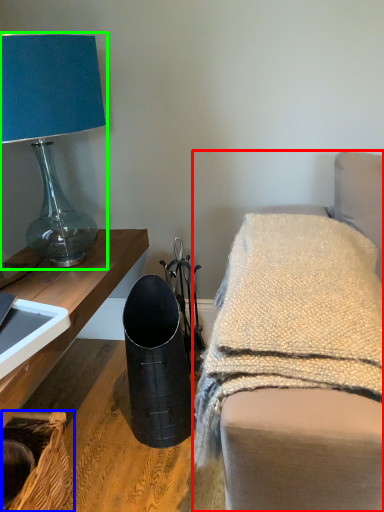
Question: Considering the real-world distances, which object is closest to furniture (highlighted by a red box)? basket (highlighted by a blue box) or lamp (highlighted by a green box).

Choices:
 (A) basket
 (B) lamp

Answer: (A)